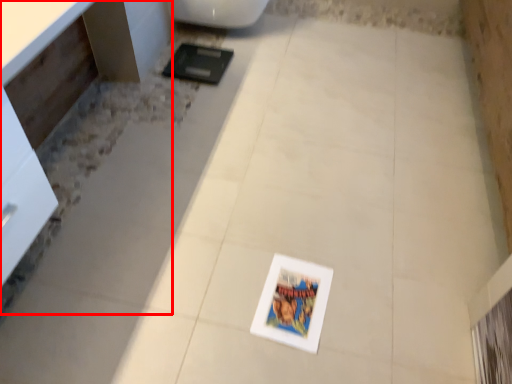
Question: From the image's perspective, considering the relative positions of vanity (annotated by the red box) and toilet in the image provided, where is vanity (annotated by the red box) located with respect to the staircase?

Choices:
 (A) above
 (B) below

Answer: (B)